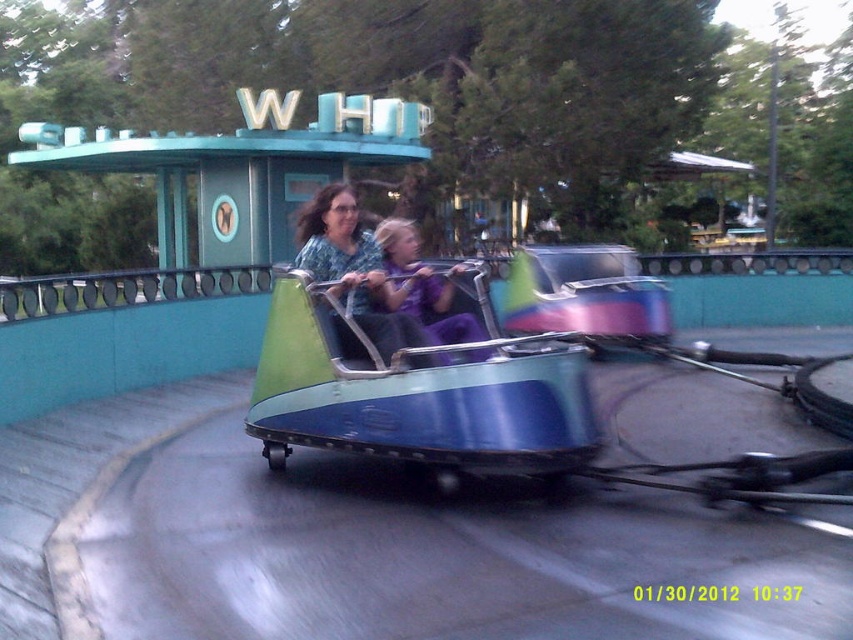
Question: Which object is closer to the camera taking this photo?

Choices:
 (A) matte green car at center
 (B) purple fabric at center

Answer: (A)

Question: Does matte green car at center appear on the left side of purple fabric at center?

Choices:
 (A) no
 (B) yes

Answer: (B)

Question: Is matte green car at center to the left of purple fabric at center from the viewer's perspective?

Choices:
 (A) yes
 (B) no

Answer: (A)

Question: Considering the relative positions of matte green car at center and purple fabric at center in the image provided, where is matte green car at center located with respect to purple fabric at center?

Choices:
 (A) above
 (B) below

Answer: (A)